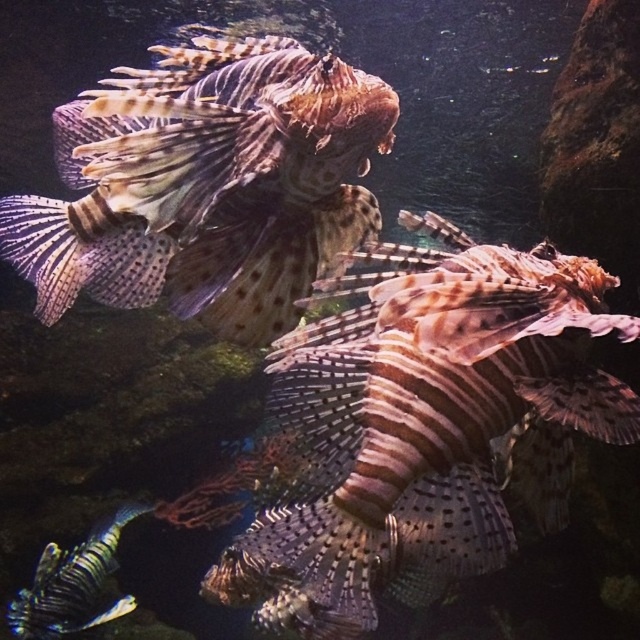
Question: Does speckled brown fish at center appear under shiny blue fish at bottom left?

Choices:
 (A) yes
 (B) no

Answer: (B)

Question: Does brown textured lionfish at center have a larger size compared to shiny blue fish at bottom left?

Choices:
 (A) yes
 (B) no

Answer: (A)

Question: Among these objects, which one is farthest from the camera?

Choices:
 (A) shiny blue fish at bottom left
 (B) brown textured lionfish at center

Answer: (A)

Question: Which object is farther from the camera taking this photo?

Choices:
 (A) brown textured lionfish at center
 (B) speckled brown fish at center
 (C) shiny blue fish at bottom left

Answer: (C)

Question: Does speckled brown fish at center appear on the left side of brown textured lionfish at center?

Choices:
 (A) yes
 (B) no

Answer: (B)

Question: Among these objects, which one is nearest to the camera?

Choices:
 (A) shiny blue fish at bottom left
 (B) brown textured lionfish at center
 (C) speckled brown fish at center

Answer: (C)